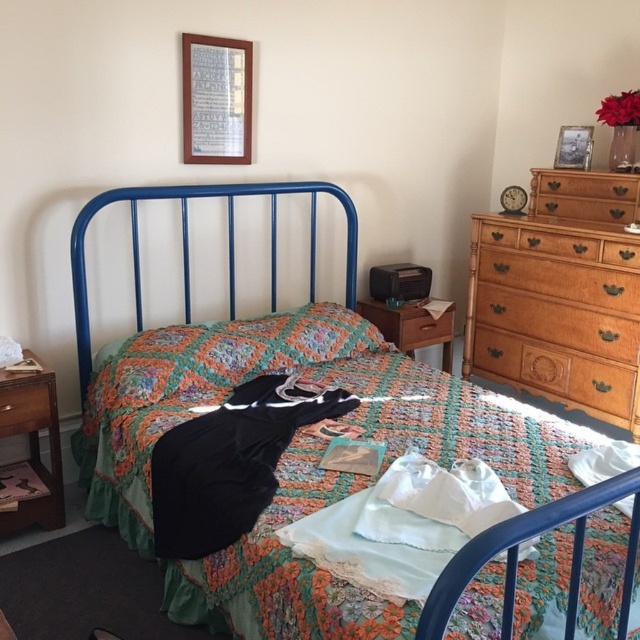
Does floral crocheted pillow at center appear over brown wood dresser at right?

Actually, floral crocheted pillow at center is below brown wood dresser at right.

Who is more forward, [113,374] or [611,273]?

Point [113,374]

The height and width of the screenshot is (640, 640). Identify the location of floral crocheted pillow at center. (227, 353).

Between floral crocheted pillow at center and brown wood drawer at center, which one appears on the left side from the viewer's perspective?

floral crocheted pillow at center

Does floral crocheted pillow at center have a smaller size compared to brown wood drawer at center?

Incorrect, floral crocheted pillow at center is not smaller in size than brown wood drawer at center.

Where is `floral crocheted pillow at center`? The height and width of the screenshot is (640, 640). floral crocheted pillow at center is located at coordinates (227, 353).

Image resolution: width=640 pixels, height=640 pixels. Identify the location of floral crocheted pillow at center. (227, 353).

Is metallic blue bed at center above wooden drawer at left?

Yes, metallic blue bed at center is above wooden drawer at left.

Between point (426, 636) and point (28, 406), which one is positioned in front?

Positioned in front is point (426, 636).

Does point (372, 312) lie in front of point (45, 397)?

That is False.

Locate an element on the screen. This screenshot has width=640, height=640. metallic blue bed at center is located at coordinates (188, 244).